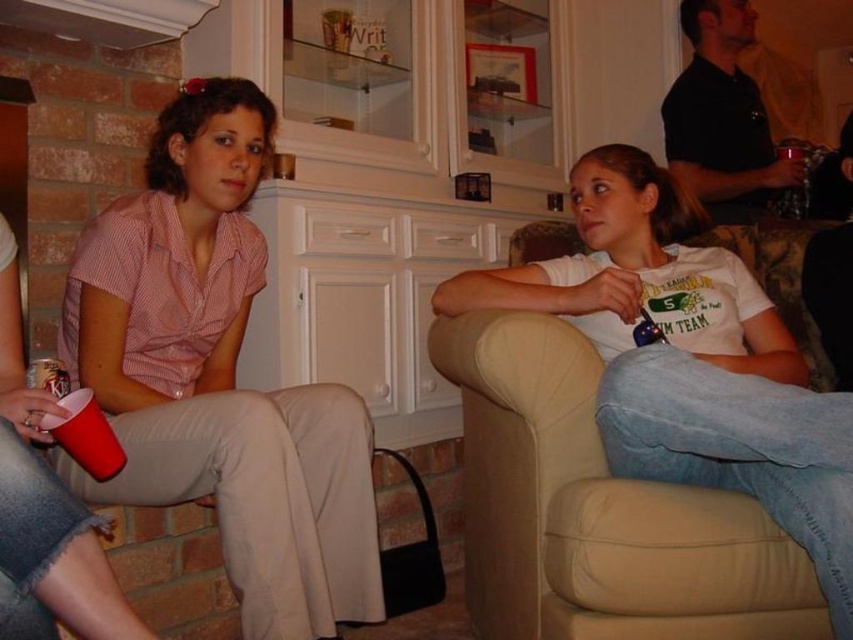
You are a guest at this gathering and want to place your drink on the table closest to you. The table you want to use is the one supporting the translucent glass cup at upper right. Is the beige leather couch at center located directly beneath that table?

The beige leather couch at center is positioned under the translucent glass cup at upper right, so yes, the couch is directly beneath the table that holds the translucent glass cup at upper right.

You are standing in the living room and want to place a small table between the two points labeled point (643, 509) and point (791, 195). Which point should the table be closer to in order to be positioned in front of both points?

The table should be closer to point (791, 195) because point (643, 509) is in front of point (791, 195), so placing the table closer to the rear point ensures it is in front of both.

You are a guest at this gathering and want to sit down on the beige leather couch at center. However, you notice a translucent glass cup at upper right nearby. To avoid knocking it over, which object should you be cautious of when moving towards the couch?

The beige leather couch at center is in front of the translucent glass cup at upper right, so you should be cautious of the translucent glass cup at upper right when moving towards the couch to avoid knocking it over.